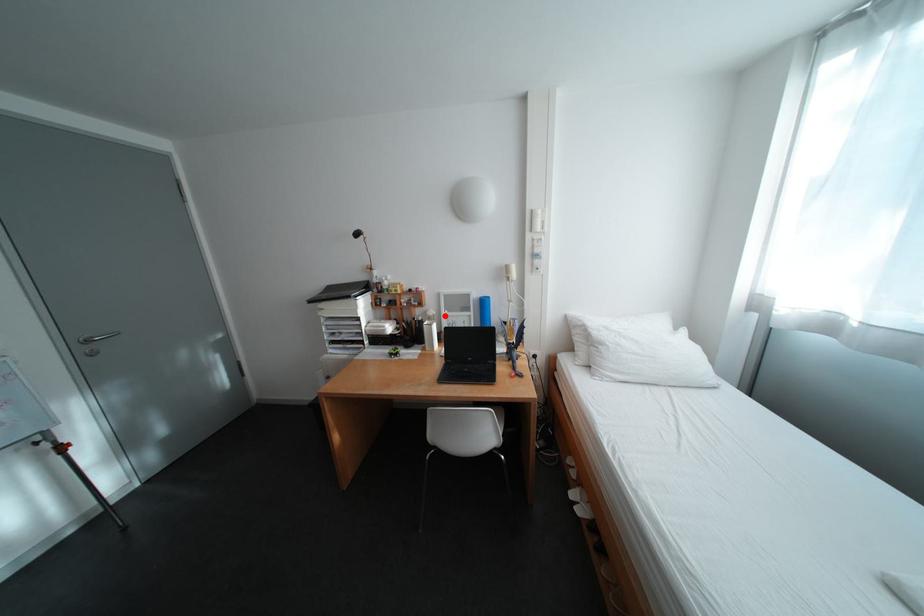
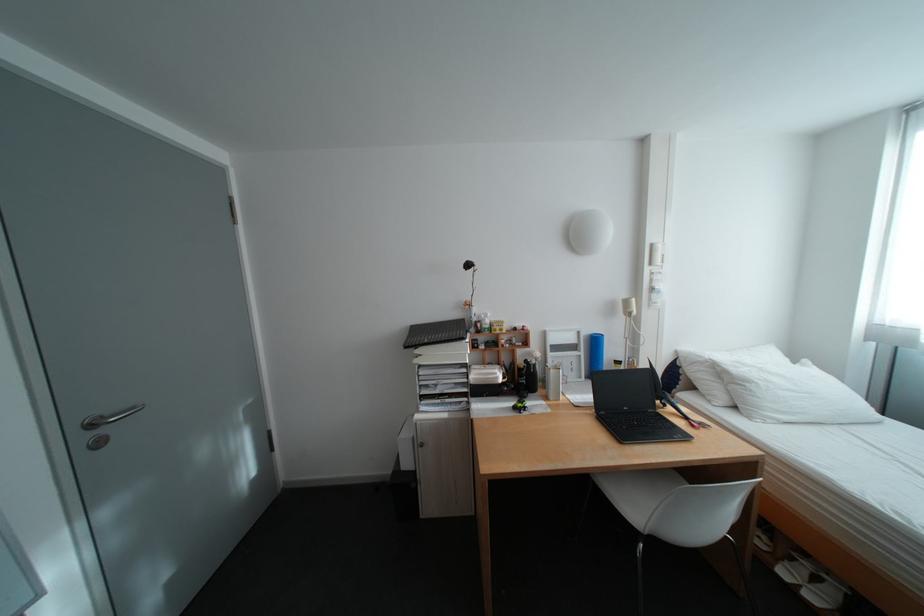
Question: I am providing you with two images of the same scene from different viewpoints. Given a red point in image1, look at the same physical point in image2. Is it:

Choices:
 (A) Closer to the viewpoint
 (B) Farther from the viewpoint

Answer: (B)